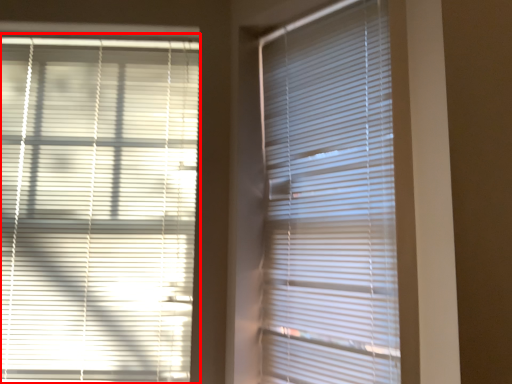
Question: From the image, what is the correct spatial relationship of window blind (annotated by the red box) in relation to window blind?

Choices:
 (A) right
 (B) left

Answer: (B)